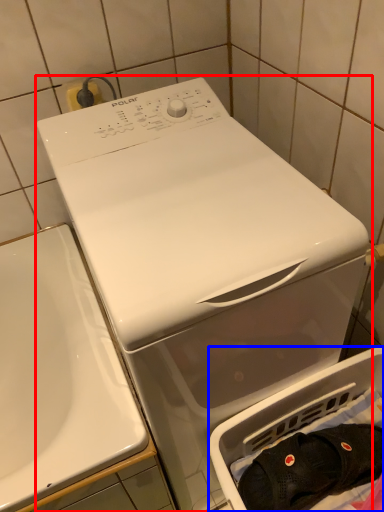
Question: Which point is further to the camera, washing machine (highlighted by a red box) or dish washer (highlighted by a blue box)?

Choices:
 (A) washing machine
 (B) dish washer

Answer: (B)